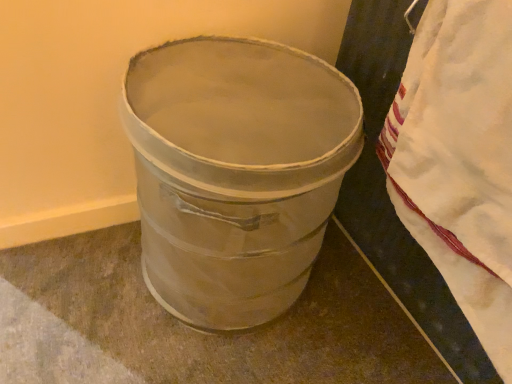
Question: In terms of width, does metallic silver trash can at center look wider or thinner when compared to white cotton blanket at right?

Choices:
 (A) wide
 (B) thin

Answer: (A)

Question: Is metallic silver trash can at center bigger or smaller than white cotton blanket at right?

Choices:
 (A) small
 (B) big

Answer: (B)

Question: Is metallic silver trash can at center in front of or behind white cotton blanket at right in the image?

Choices:
 (A) behind
 (B) front

Answer: (A)

Question: Is white cotton blanket at right taller or shorter than metallic silver trash can at center?

Choices:
 (A) short
 (B) tall

Answer: (A)

Question: Is white cotton blanket at right bigger or smaller than metallic silver trash can at center?

Choices:
 (A) small
 (B) big

Answer: (A)

Question: Is point (502, 329) closer or farther from the camera than point (253, 218)?

Choices:
 (A) farther
 (B) closer

Answer: (B)

Question: From a real-world perspective, is white cotton blanket at right positioned above or below metallic silver trash can at center?

Choices:
 (A) below
 (B) above

Answer: (B)